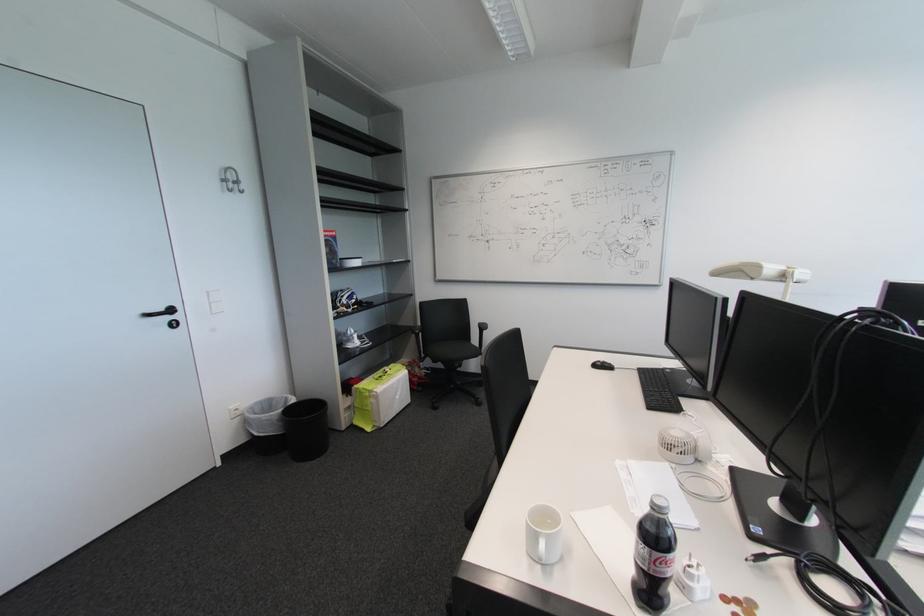
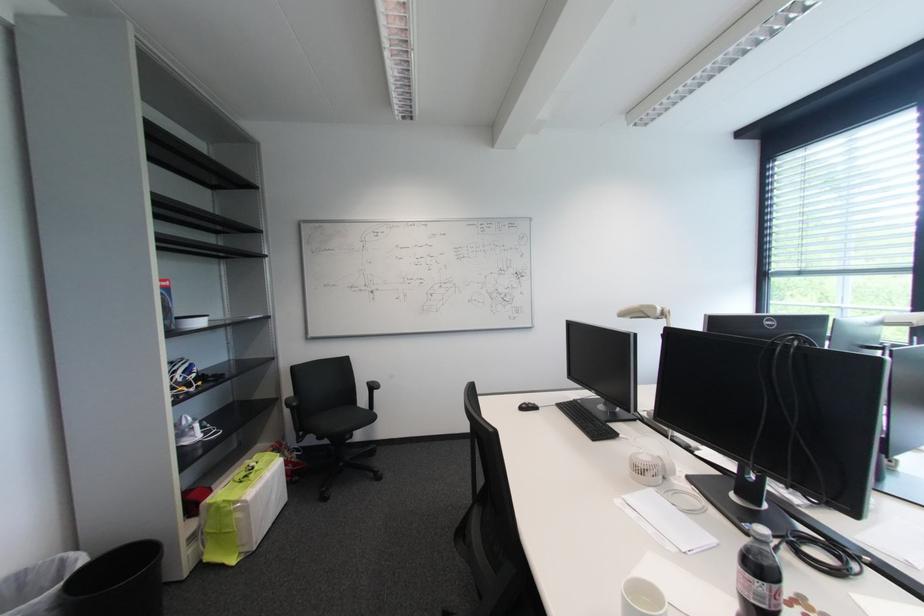
Locate, in the second image, the point that corresponds to (x=439, y=361) in the first image.

(322, 438)